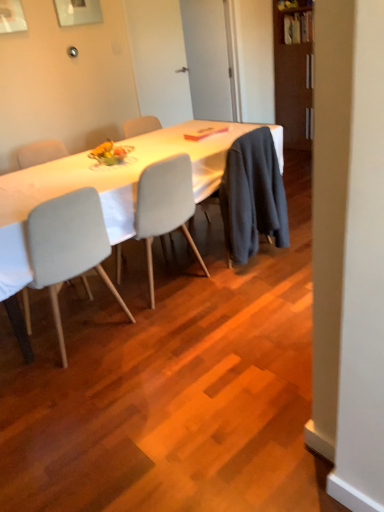
Question: Is white fabric table at center wider or thinner than pink matte book at center?

Choices:
 (A) thin
 (B) wide

Answer: (B)

Question: In the image, is white fabric table at center on the left side or the right side of pink matte book at center?

Choices:
 (A) left
 (B) right

Answer: (A)

Question: Based on their relative distances, which object is nearer to the pink matte book at center?

Choices:
 (A) white fabric table at center
 (B) metallic silver picture frame at upper center
 (C) light gray fabric chair at center, which ranks as the 2th chair in right-to-left order
 (D) light gray fabric chair at center, which ranks as the 1th chair in right-to-left order
 (E) dark gray fabric robe at center

Answer: (A)

Question: Estimate the real-world distances between objects in this image. Which object is farther from the pink matte book at center?

Choices:
 (A) dark gray fabric robe at center
 (B) light gray fabric chair at center, which is the first chair in left-to-right order
 (C) light gray fabric chair at center, which ranks as the 1th chair in right-to-left order
 (D) white fabric table at center
 (E) brown wooden bookshelf at upper right

Answer: (E)